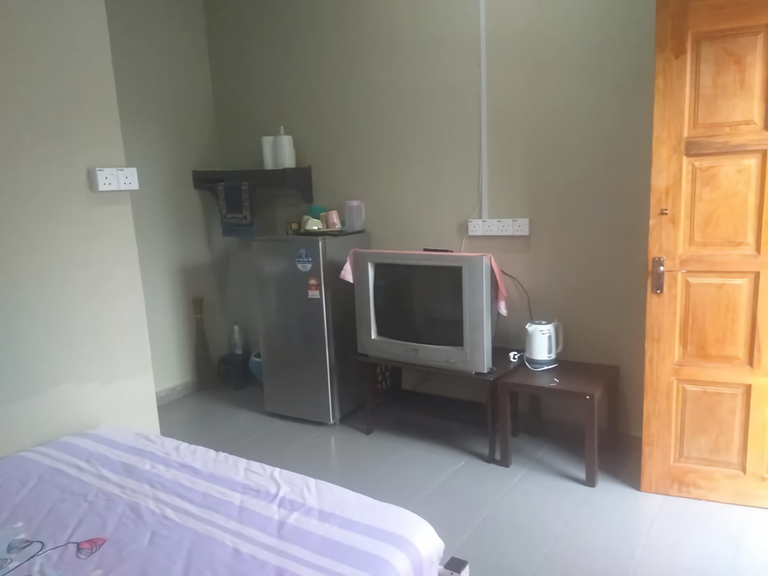
At what (x,y) coordinates should I click in order to perform the action: click on door handle. Please return your answer as a coordinate pair (x, y). This screenshot has width=768, height=576. Looking at the image, I should click on (659, 276).